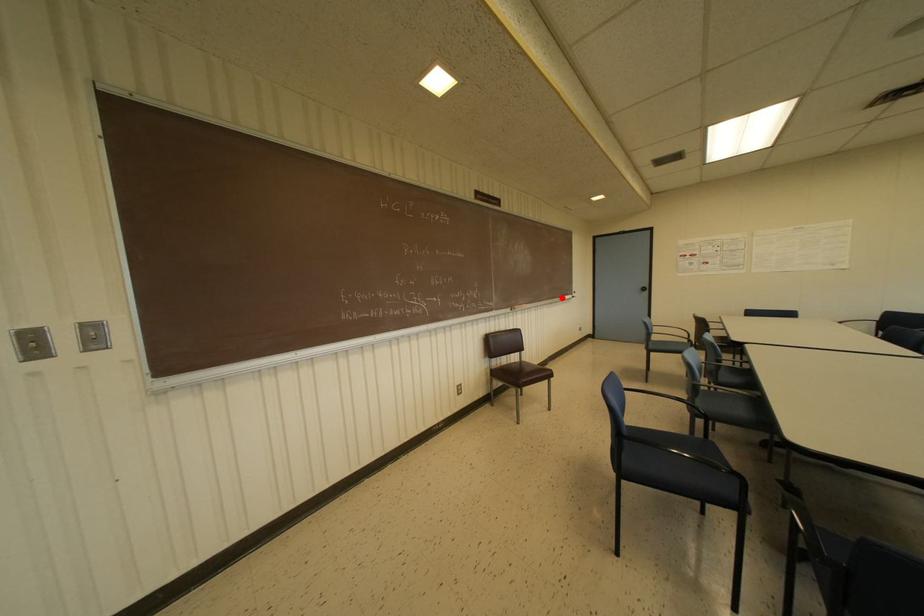
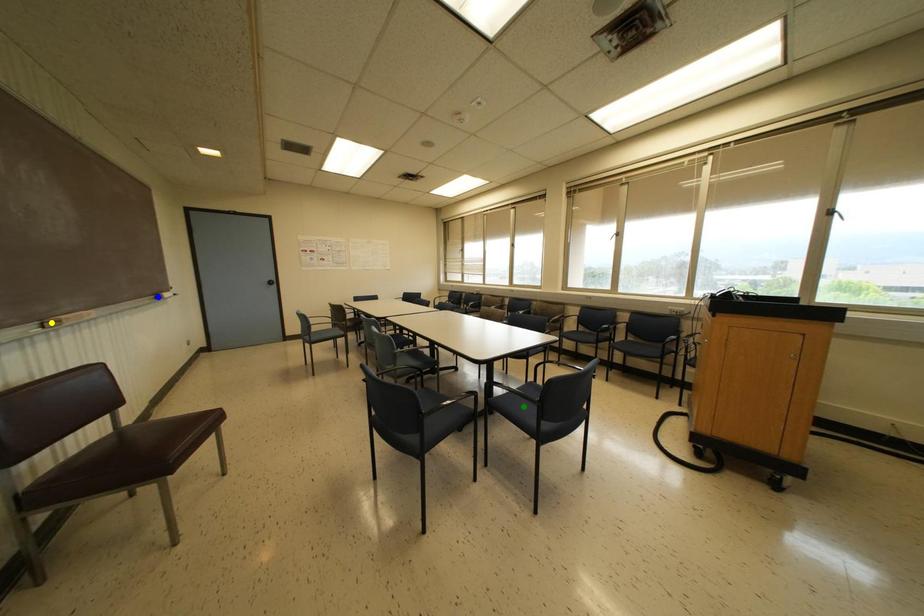
Question: I am providing you with two images of the same scene from different viewpoints. A red point is marked on the first image. You are given multiple points on the second image. Which point in image 2 represents the same 3d spot as the red point in image 1?

Choices:
 (A) blue point
 (B) green point
 (C) yellow point

Answer: (A)